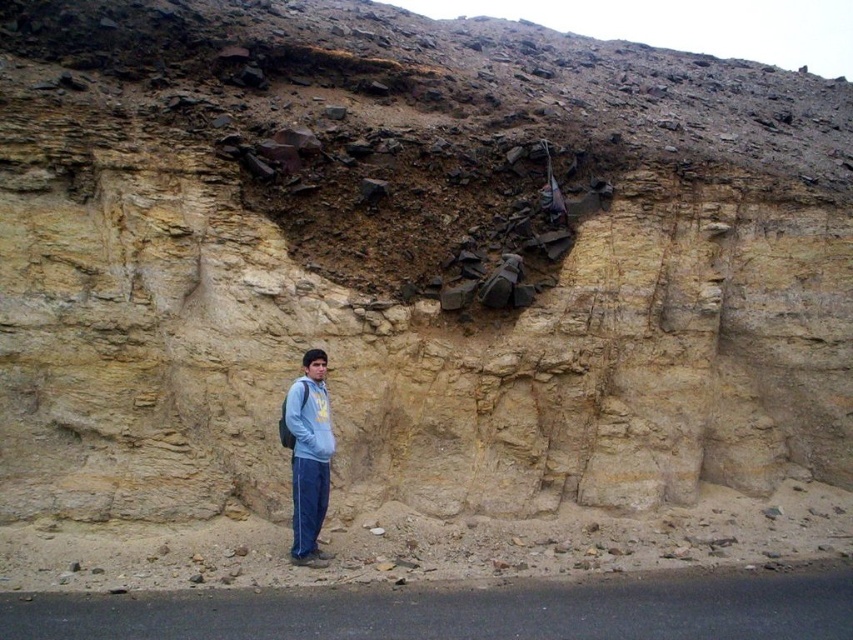
You are standing at the base of the cliff and want to reach the point marked at coordinates [294,538]. Given that the distance from your current position to that point is 23.67 feet, can you estimate how far you need to walk to reach it?

The point marked at coordinates [294,538] is 23.67 feet away from your current position, so you need to walk approximately 23.67 feet to reach it.

You are a photographer aiming to capture the man in the image standing in front of the rock face. To ensure the light blue denim pants at lower left are visible in the photo, where should you position the camera relative to the man?

The light blue denim pants at lower left are located at point 0.713 on the x axis and 0.362 on the y axis, so position the camera slightly to the left and lower down to capture them in the frame.